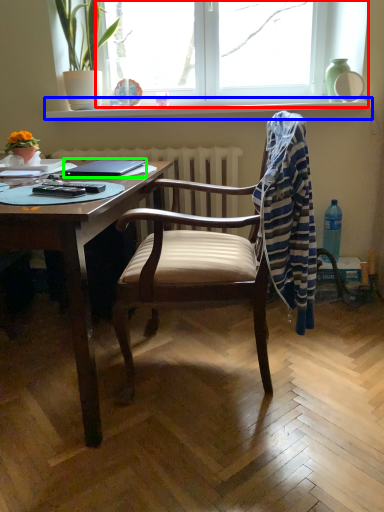
Question: Which object is the farthest from window (highlighted by a red box)? Choose among these: window sill (highlighted by a blue box) or laptop (highlighted by a green box).

Choices:
 (A) window sill
 (B) laptop

Answer: (B)